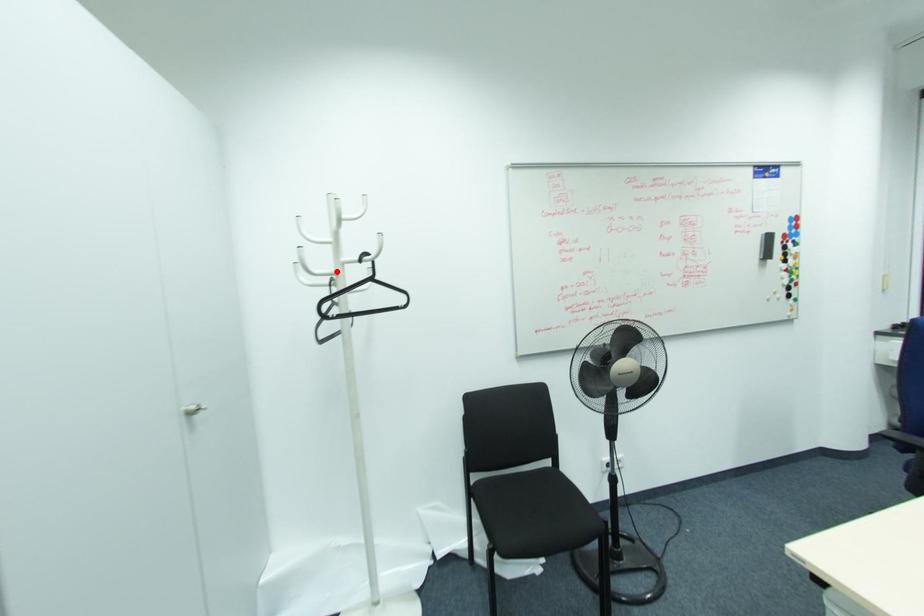
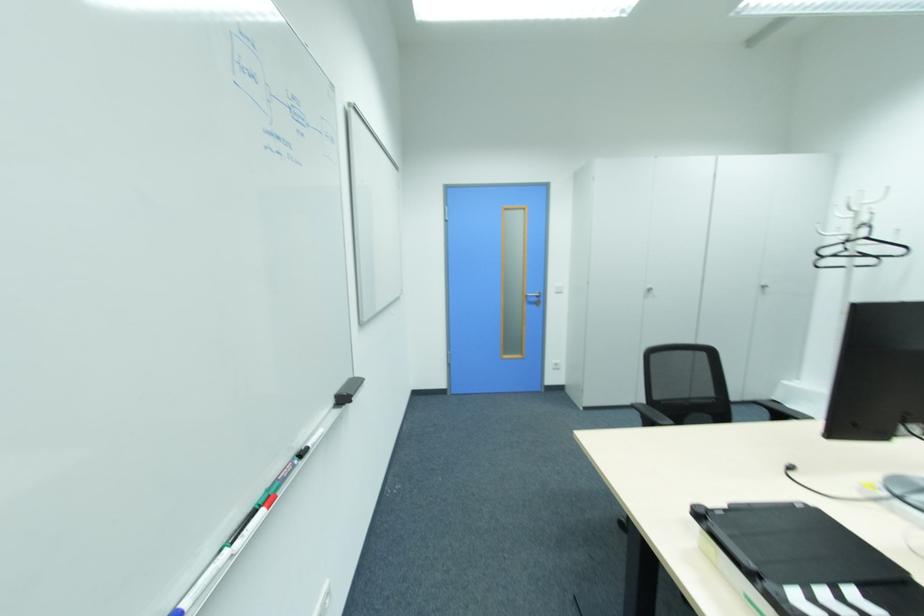
The point at the highlighted location is marked in the first image. Where is the corresponding point in the second image?

(849, 233)